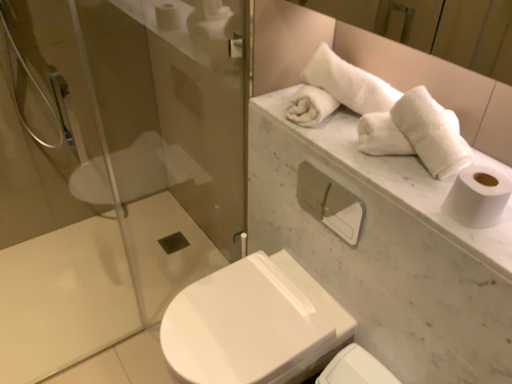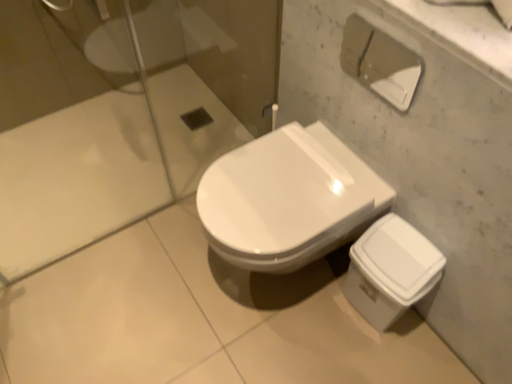
Question: How did the camera likely rotate when shooting the video?

Choices:
 (A) rotated downward
 (B) rotated upward

Answer: (A)